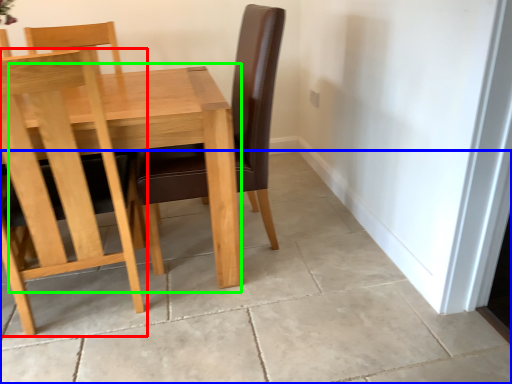
Question: Based on their relative distances, which object is nearer to chair (highlighted by a red box)? Choose from concrete (highlighted by a blue box) and table (highlighted by a green box).

Choices:
 (A) concrete
 (B) table

Answer: (B)